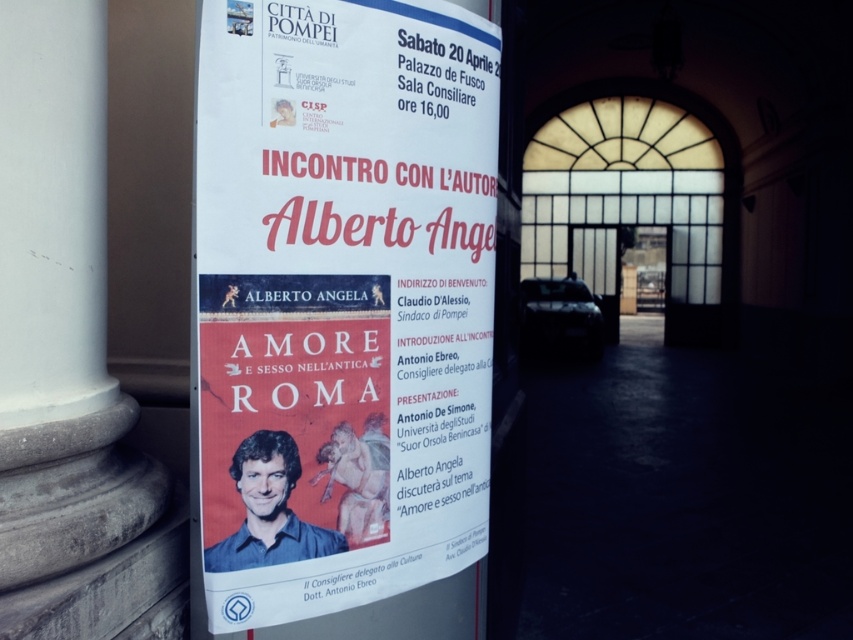
Is white paper poster at center above white marble pillar at left?

Incorrect, white paper poster at center is not positioned above white marble pillar at left.

Who is shorter, white paper poster at center or white marble pillar at left?

Standing shorter between the two is white marble pillar at left.

Where is `white paper poster at center`? white paper poster at center is located at coordinates (341, 316).